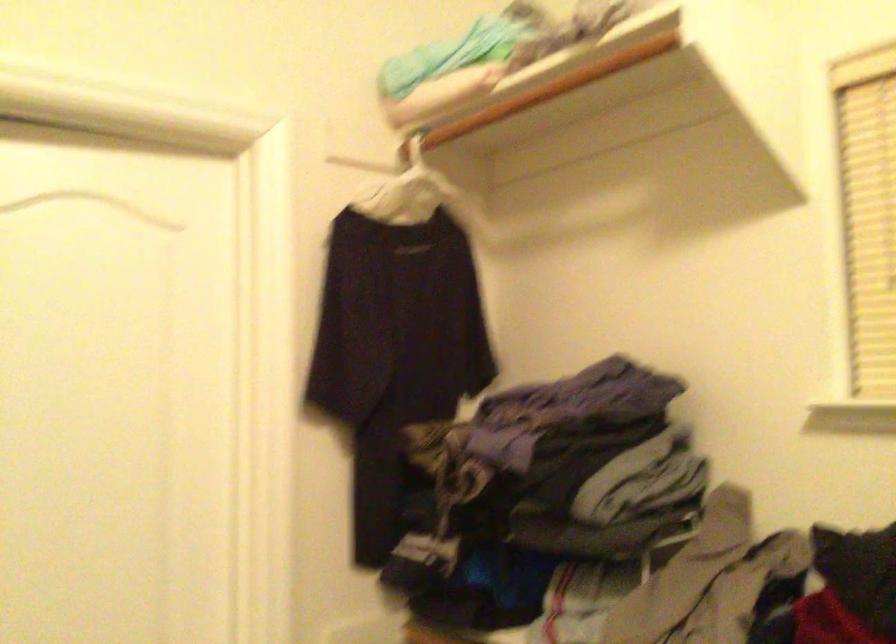
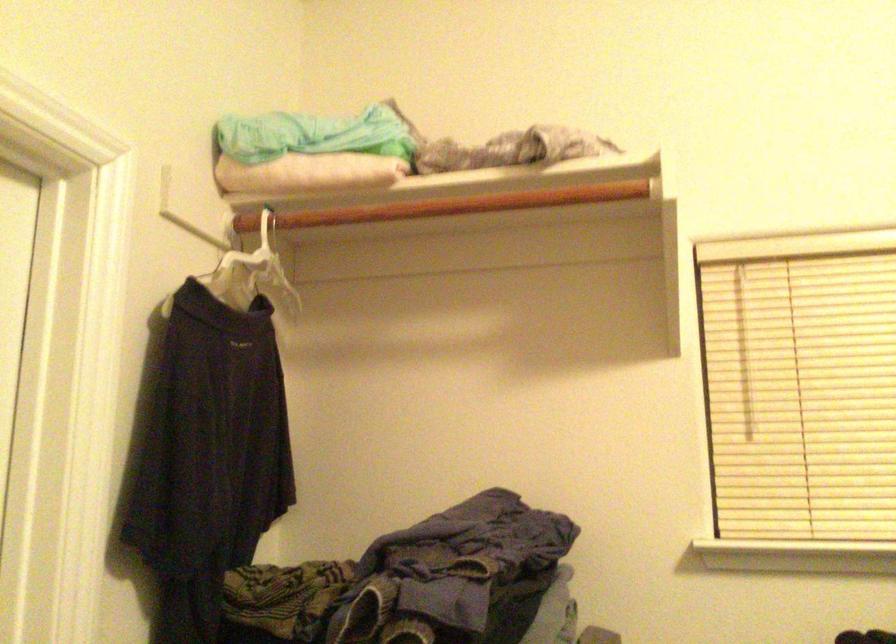
Where in the second image is the point corresponding to (523,100) from the first image?

(452, 205)